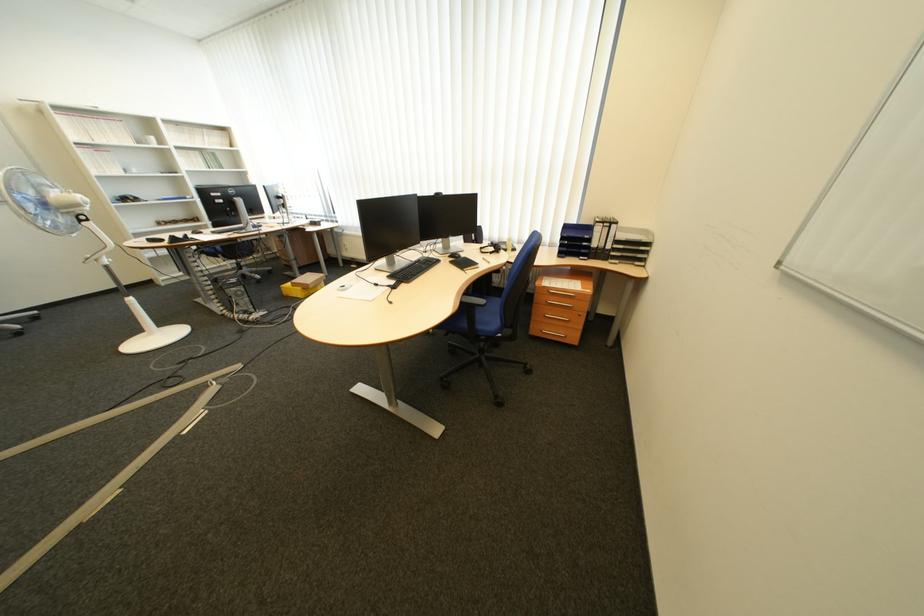
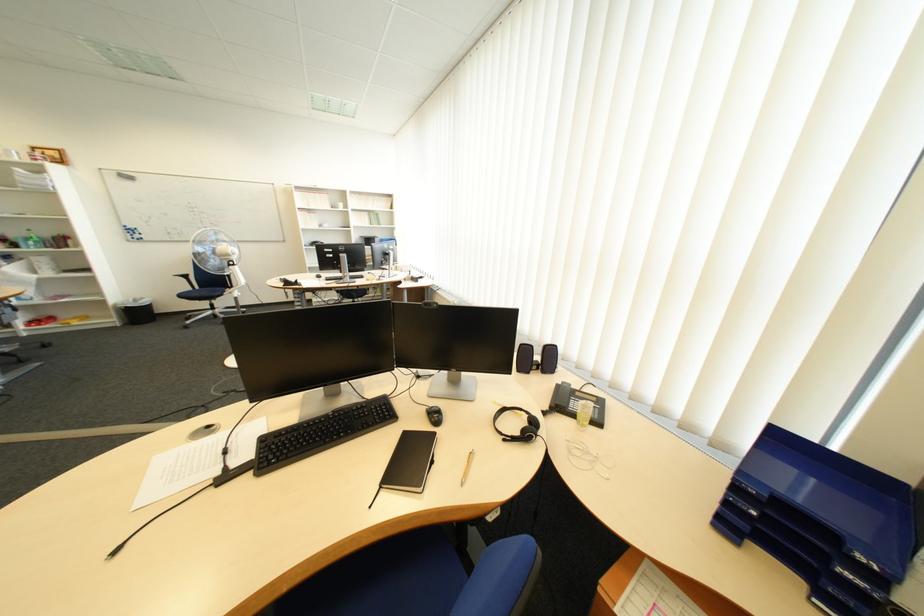
Find the pixel in the second image that matches point 478,270 in the first image.

(396, 488)